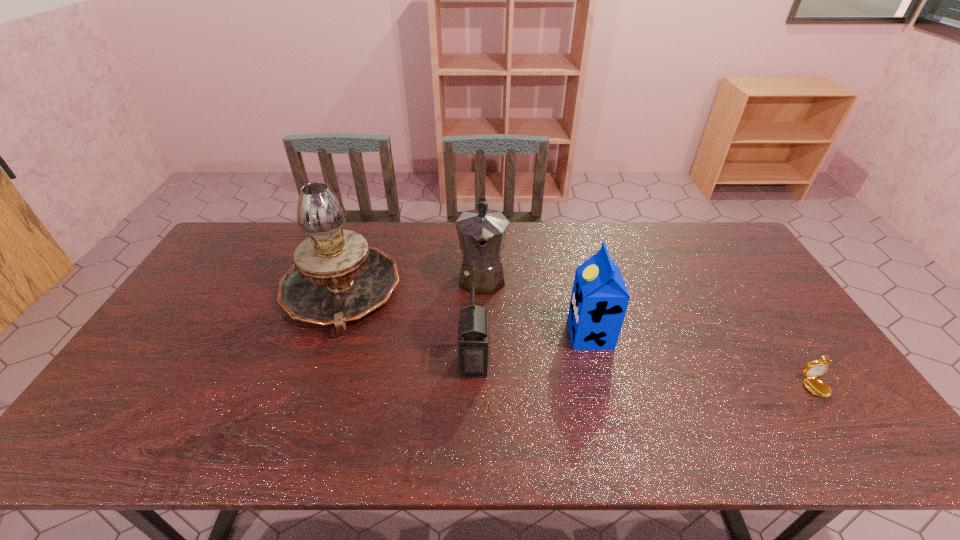
The height and width of the screenshot is (540, 960). In the image, there is a desktop. Identify the location of vacant space at the right edge. (814, 357).

This screenshot has width=960, height=540. Identify the location of free space at the far left corner of the desktop. (223, 262).

The image size is (960, 540). What are the coordinates of `vacant space at the far right corner` in the screenshot? It's located at (732, 247).

You are a GUI agent. You are given a task and a screenshot of the screen. Output one action in this format:
    pyautogui.click(x=<x>, y=<y>)
    Task: Click on the blank region between the lantern and the carton
    
    Given the screenshot: What is the action you would take?
    pyautogui.click(x=532, y=349)

What are the coordinates of `empty space that is in between the coffeepot and the leftmost object` in the screenshot? It's located at coord(411,284).

This screenshot has width=960, height=540. Find the location of `vacant point located between the second object from right to left and the rightmost object`. vacant point located between the second object from right to left and the rightmost object is located at coordinates (707, 360).

Where is `empty space that is in between the leftmost object and the lantern`? The width and height of the screenshot is (960, 540). empty space that is in between the leftmost object and the lantern is located at coordinates (407, 327).

Image resolution: width=960 pixels, height=540 pixels. I want to click on free space between the oil lamp and the coffeepot, so click(x=411, y=284).

The image size is (960, 540). Identify the location of free spot between the coffeepot and the tallest object. (411, 284).

This screenshot has width=960, height=540. Find the location of `unoccupied area between the coffeepot and the pocket watch`. unoccupied area between the coffeepot and the pocket watch is located at coordinates (652, 330).